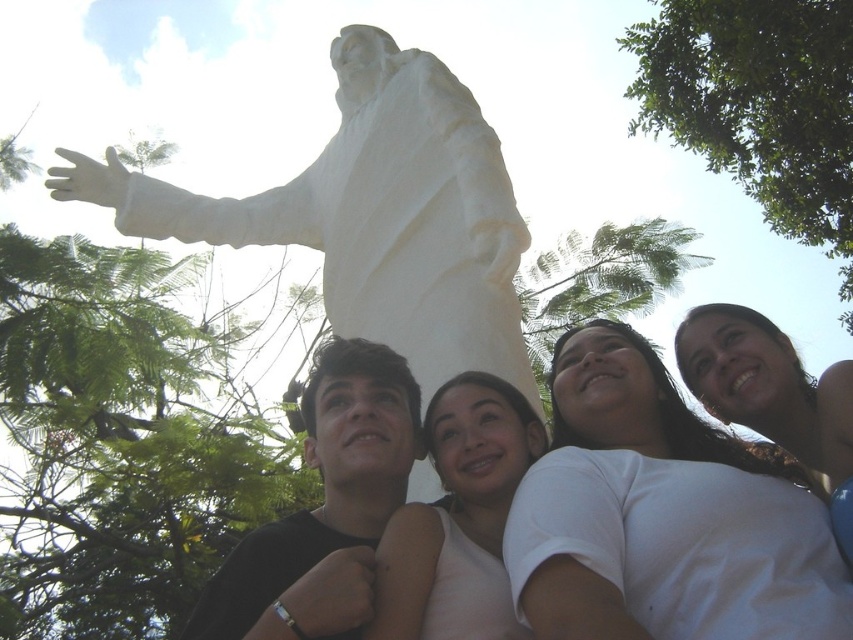
Question: Is black matte shirt at lower left to the right of smooth white statue at center from the viewer's perspective?

Choices:
 (A) yes
 (B) no

Answer: (B)

Question: Estimate the real-world distances between objects in this image. Which object is farther from the white t-shirt at lower right?

Choices:
 (A) smooth white statue at center
 (B) black matte shirt at lower left
 (C) matte white statue at upper center
 (D) white marble statue at upper center

Answer: (D)

Question: Is white marble statue at upper center smaller than matte white statue at upper center?

Choices:
 (A) yes
 (B) no

Answer: (B)

Question: Which object is farther from the camera taking this photo?

Choices:
 (A) white t-shirt at lower right
 (B) matte white statue at upper center
 (C) smooth white statue at center

Answer: (B)

Question: Which point is farther from the camera taking this photo?

Choices:
 (A) (790, 381)
 (B) (293, 541)
 (C) (502, 630)

Answer: (A)

Question: Can you confirm if white t-shirt at lower right is positioned to the right of white marble statue at upper center?

Choices:
 (A) no
 (B) yes

Answer: (B)